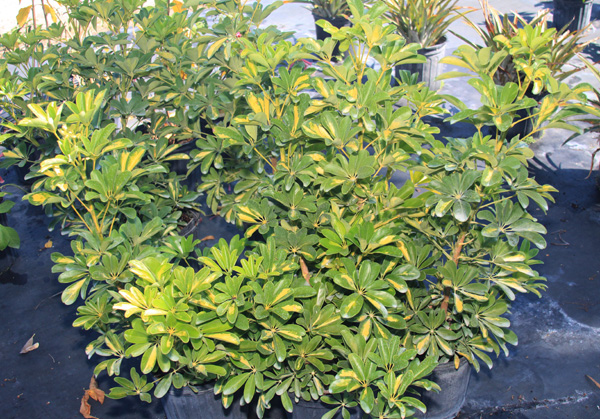
You are a GUI agent. You are given a task and a screenshot of the screen. Output one action in this format:
    pyautogui.click(x=<x>, y=<y>)
    Task: Click on the light
    The height and width of the screenshot is (419, 600).
    Given the screenshot: What is the action you would take?
    pyautogui.click(x=170, y=297)